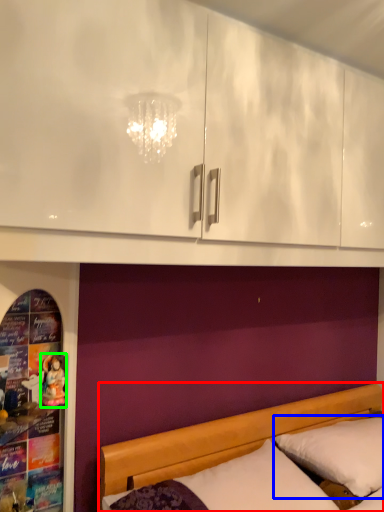
Question: Which object is positioned closest to bed (highlighted by a red box)? Select from pillow (highlighted by a blue box) and doll (highlighted by a green box).

Choices:
 (A) pillow
 (B) doll

Answer: (A)